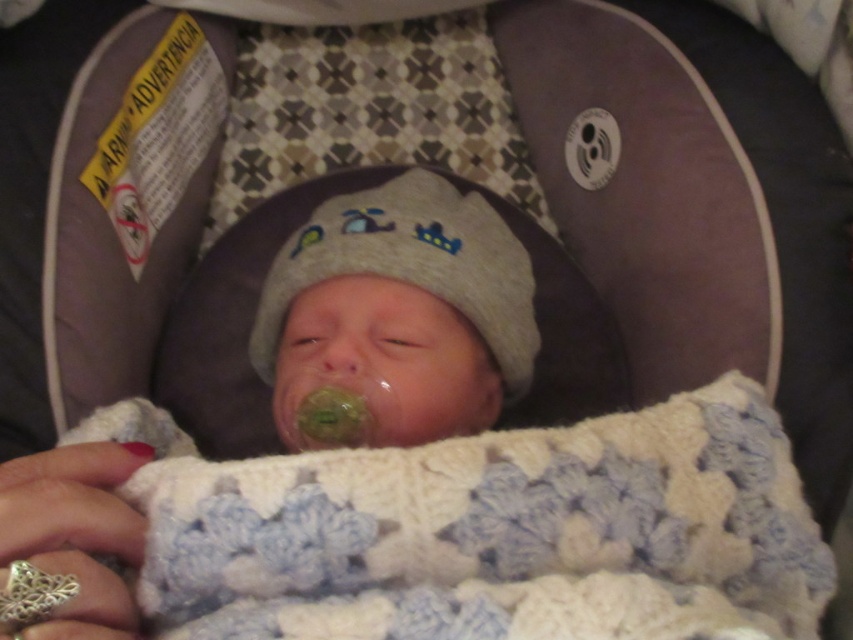
Question: Is white knitted blanket at center further to camera compared to gray knit hat at center?

Choices:
 (A) no
 (B) yes

Answer: (A)

Question: Among these points, which one is nearest to the camera?

Choices:
 (A) (474, 234)
 (B) (437, 480)
 (C) (1, 616)

Answer: (C)

Question: Observing the image, what is the correct spatial positioning of white knitted blanket at center in reference to gray knit hat at center?

Choices:
 (A) left
 (B) right

Answer: (B)

Question: Which object appears closest to the camera in this image?

Choices:
 (A) gray knit hat at center
 (B) white knitted blanket at center
 (C) silver metallic teething ring at lower left

Answer: (C)

Question: Among these objects, which one is farthest from the camera?

Choices:
 (A) silver metallic teething ring at lower left
 (B) white knitted blanket at center

Answer: (B)

Question: Is white knitted blanket at center thinner than gray knit hat at center?

Choices:
 (A) no
 (B) yes

Answer: (A)